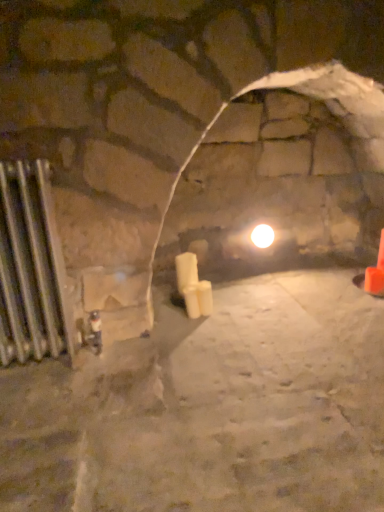
Question: Is silver metallic radiator at left at the back of white matte candle at center?

Choices:
 (A) no
 (B) yes

Answer: (A)

Question: From a real-world perspective, is white matte candle at center on top of silver metallic radiator at left?

Choices:
 (A) yes
 (B) no

Answer: (B)

Question: Is white matte candle at center bigger than silver metallic radiator at left?

Choices:
 (A) yes
 (B) no

Answer: (B)

Question: Is white matte candle at center oriented towards silver metallic radiator at left?

Choices:
 (A) no
 (B) yes

Answer: (A)

Question: Can you confirm if white matte candle at center is taller than silver metallic radiator at left?

Choices:
 (A) no
 (B) yes

Answer: (A)

Question: From a real-world perspective, relative to white matte candle at center, is white glossy light bulb at center vertically above or below?

Choices:
 (A) below
 (B) above

Answer: (B)

Question: Is white glossy light bulb at center inside or outside of white matte candle at center?

Choices:
 (A) outside
 (B) inside

Answer: (A)

Question: Does point (263, 225) appear closer or farther from the camera than point (180, 261)?

Choices:
 (A) closer
 (B) farther

Answer: (B)

Question: From the image's perspective, is white glossy light bulb at center above or below white matte candle at center?

Choices:
 (A) above
 (B) below

Answer: (A)

Question: Is white glossy light bulb at center wider or thinner than silver metallic radiator at left?

Choices:
 (A) wide
 (B) thin

Answer: (B)

Question: From a real-world perspective, is white glossy light bulb at center above or below silver metallic radiator at left?

Choices:
 (A) above
 (B) below

Answer: (B)

Question: From the image's perspective, is white glossy light bulb at center positioned above or below silver metallic radiator at left?

Choices:
 (A) below
 (B) above

Answer: (B)

Question: Is white glossy light bulb at center bigger or smaller than silver metallic radiator at left?

Choices:
 (A) big
 (B) small

Answer: (B)

Question: From a real-world perspective, is white glossy light bulb at center above or below orange plastic traffic cone at right?

Choices:
 (A) above
 (B) below

Answer: (A)

Question: Considering the positions of white glossy light bulb at center and orange plastic traffic cone at right in the image, is white glossy light bulb at center bigger or smaller than orange plastic traffic cone at right?

Choices:
 (A) small
 (B) big

Answer: (A)